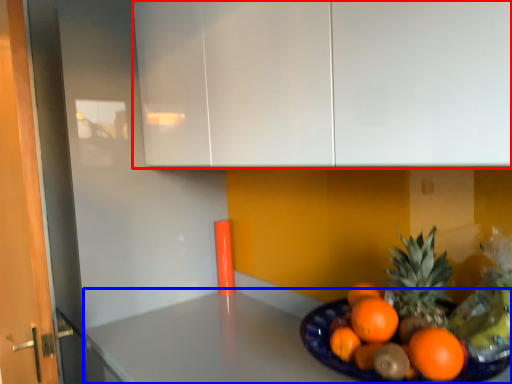
Question: Which object appears farthest to the camera in this image, cabinetry (highlighted by a red box) or counter top (highlighted by a blue box)?

Choices:
 (A) cabinetry
 (B) counter top

Answer: (B)